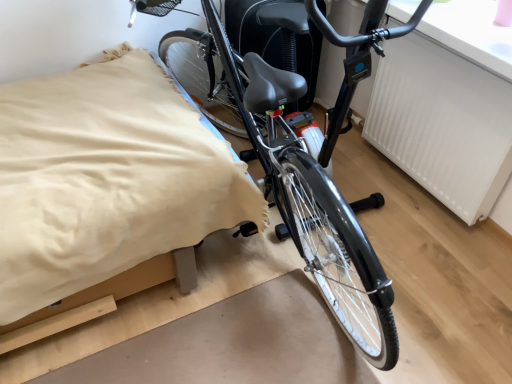
Where is `free space to the left of white textured radiator at upper right`? This screenshot has height=384, width=512. free space to the left of white textured radiator at upper right is located at coordinates (366, 182).